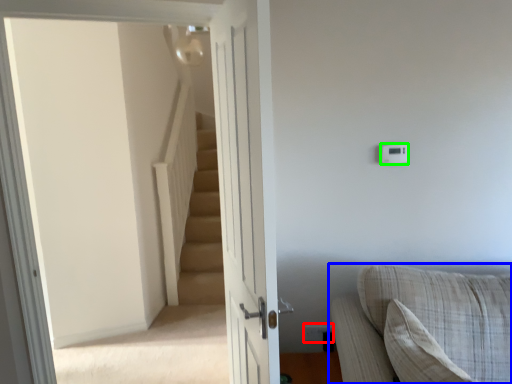
Question: Estimate the real-world distances between objects in this image. Which object is closer to electric outlet (highlighted by a red box), studio couch (highlighted by a blue box) or light switch (highlighted by a green box)?

Choices:
 (A) studio couch
 (B) light switch

Answer: (A)